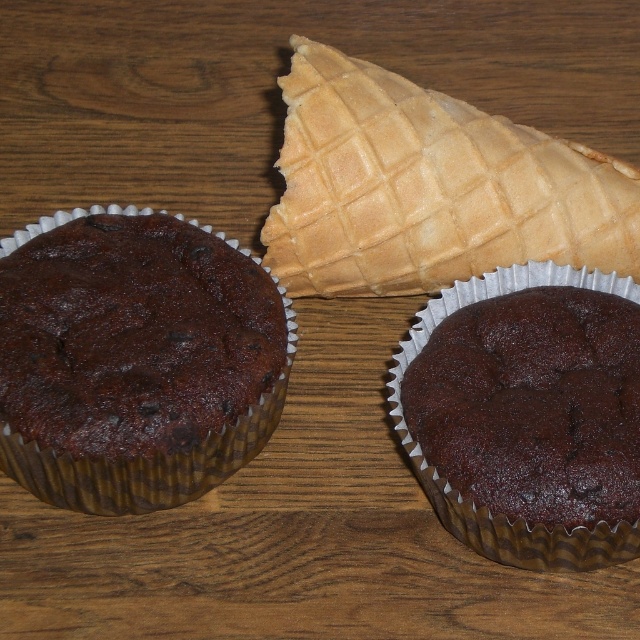
You are standing at the origin point of the image. There is a point marked at coordinates point (428,188). What object is located at that point?

The golden brown waffle cone at upper center is located at point (428,188).